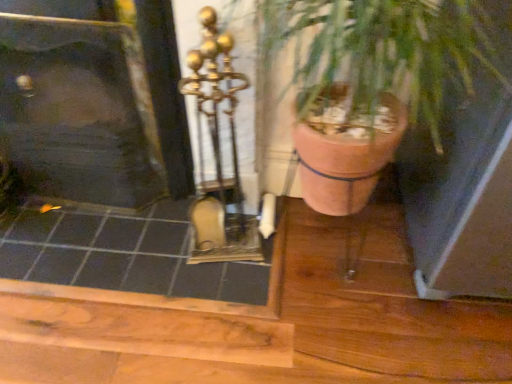
Describe the element at coordinates (79, 113) in the screenshot. I see `matte black fireplace at left` at that location.

In order to click on matte black fireplace at left in this screenshot , I will do `click(79, 113)`.

What are the coordinates of `matte black fireplace at left` in the screenshot? It's located at (79, 113).